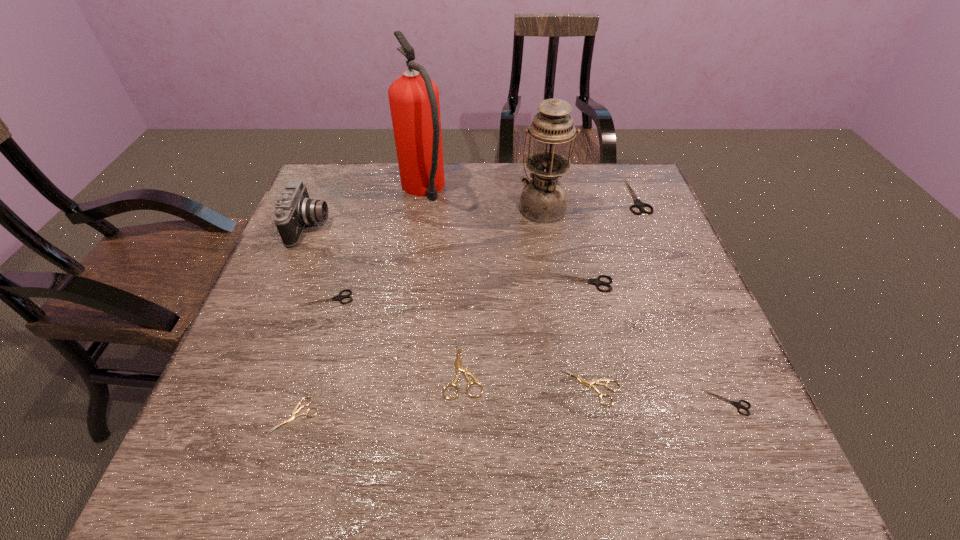
Where is `red fire extinguisher`? Image resolution: width=960 pixels, height=540 pixels. red fire extinguisher is located at coordinates (414, 102).

Locate an element on the screen. The image size is (960, 540). the tallest object is located at coordinates (414, 102).

This screenshot has width=960, height=540. What are the coordinates of `the ninth shortest object` in the screenshot? It's located at (543, 199).

Identify the location of the eighth shortest object. (294, 209).

Image resolution: width=960 pixels, height=540 pixels. Identify the location of black camera. (294, 209).

At what (x,y) coordinates should I click in order to perform the action: click on the farthest black shears. Please return your answer as a coordinate pair (x, y). This screenshot has width=960, height=540. Looking at the image, I should click on (639, 204).

Where is `the tallest shears`? The width and height of the screenshot is (960, 540). the tallest shears is located at coordinates (639, 204).

Identify the location of the third black shears from right to left. This screenshot has width=960, height=540. (595, 281).

Where is `the second tallest shears`? Image resolution: width=960 pixels, height=540 pixels. the second tallest shears is located at coordinates (595, 281).

Identify the location of the leftmost black shears. (339, 297).